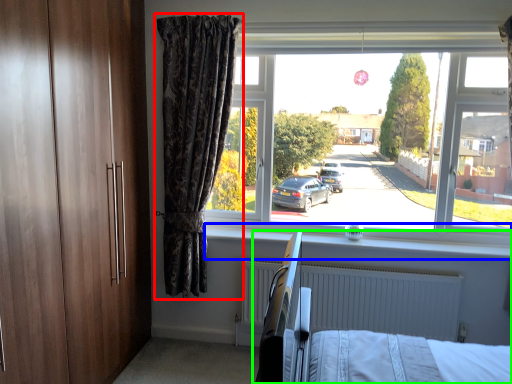
Question: Which object is the closest to the curtain (highlighted by a red box)? Choose among these: window sill (highlighted by a blue box) or hospital bed (highlighted by a green box).

Choices:
 (A) window sill
 (B) hospital bed

Answer: (A)